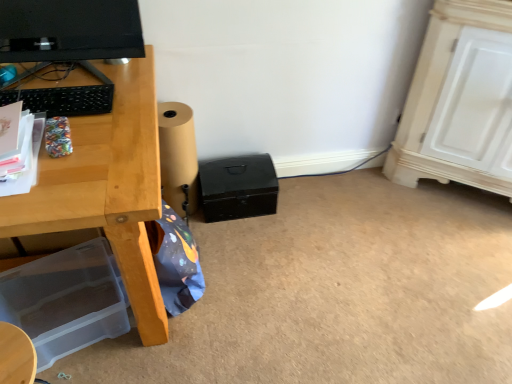
Image resolution: width=512 pixels, height=384 pixels. I want to click on vacant space to the right of black matte box at center, which is the 2th box from front to back, so click(x=293, y=224).